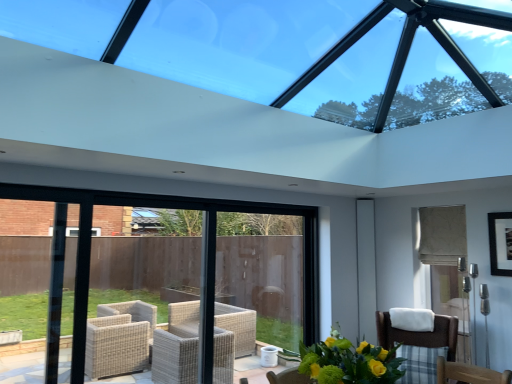
This screenshot has width=512, height=384. What do you see at coordinates (366, 269) in the screenshot?
I see `white glossy screen door at right` at bounding box center [366, 269].

Find the location of a particular element. This screenshot has width=512, height=384. white glossy screen door at right is located at coordinates (366, 269).

Describe the element at coordinates (500, 243) in the screenshot. I see `black matte picture frame at upper right` at that location.

Where is `transparent glass window at upper center`? The image size is (512, 384). transparent glass window at upper center is located at coordinates (316, 54).

Locate an element on the screen. The height and width of the screenshot is (384, 512). brown woven chair at lower right is located at coordinates (420, 345).

From a real-world perspective, which object rests below the other?

black matte picture frame at upper right, from a real-world perspective.

Which is correct: transparent glass window at upper center is inside black matte picture frame at upper right, or outside of it?

transparent glass window at upper center is spatially situated outside black matte picture frame at upper right.

Is point (494, 27) in front of point (511, 261)?

Yes, it is.

Does black matte picture frame at upper right have a lesser height compared to white glossy screen door at right?

Yes, black matte picture frame at upper right is shorter than white glossy screen door at right.

Considering the sizes of objects black matte picture frame at upper right and white glossy screen door at right in the image provided, who is smaller, black matte picture frame at upper right or white glossy screen door at right?

black matte picture frame at upper right.

Is white glossy screen door at right at the back of black matte picture frame at upper right?

No.

From the image's perspective, which object appears higher, transparent glass window at upper center or yellow-green bouquet at lower center?

transparent glass window at upper center appears higher in the image.

Is transparent glass window at upper center positioned far away from yellow-green bouquet at lower center?

transparent glass window at upper center is positioned a significant distance from yellow-green bouquet at lower center.

Is transparent glass window at upper center completely or partially outside of yellow-green bouquet at lower center?

Yes, transparent glass window at upper center is located beyond the bounds of yellow-green bouquet at lower center.

Does transparent glass window at upper center have a smaller size compared to yellow-green bouquet at lower center?

Actually, transparent glass window at upper center might be larger than yellow-green bouquet at lower center.

From a real-world perspective, relative to yellow-green bouquet at lower center, is black matte picture frame at upper right vertically above or below?

black matte picture frame at upper right is situated higher than yellow-green bouquet at lower center in the real world.

Which is correct: black matte picture frame at upper right is inside yellow-green bouquet at lower center, or outside of it?

The correct answer is: outside.

From the image's perspective, is black matte picture frame at upper right positioned above or below yellow-green bouquet at lower center?

black matte picture frame at upper right is above yellow-green bouquet at lower center.

From the picture: Considering the positions of objects black matte picture frame at upper right and yellow-green bouquet at lower center in the image provided, who is in front, black matte picture frame at upper right or yellow-green bouquet at lower center?

Positioned in front is yellow-green bouquet at lower center.

Is point (372, 251) closer to viewer compared to point (364, 358)?

That is False.

From the picture: Who is taller, white glossy screen door at right or yellow-green bouquet at lower center?

Standing taller between the two is white glossy screen door at right.

From the image's perspective, is white glossy screen door at right positioned above or below yellow-green bouquet at lower center?

white glossy screen door at right is below yellow-green bouquet at lower center.

What's the angular difference between white glossy screen door at right and yellow-green bouquet at lower center's facing directions?

They differ by 47 degrees in their facing directions.

Is the surface of black matte picture frame at upper right in direct contact with transparent glass window at upper center?

No, black matte picture frame at upper right is not with transparent glass window at upper center.

Is black matte picture frame at upper right further to the viewer compared to transparent glass window at upper center?

Yes, it is behind transparent glass window at upper center.

Looking at this image, from the image's perspective, which one is positioned higher, black matte picture frame at upper right or transparent glass window at upper center?

transparent glass window at upper center appears higher in the image.

Considering the sizes of objects black matte picture frame at upper right and transparent glass window at upper center in the image provided, who is taller, black matte picture frame at upper right or transparent glass window at upper center?

With more height is transparent glass window at upper center.

Which of these two, brown woven chair at lower right or transparent glass window at upper center, is thinner?

Thinner between the two is brown woven chair at lower right.

Which of these two, brown woven chair at lower right or transparent glass window at upper center, stands taller?

Standing taller between the two is transparent glass window at upper center.

From the image's perspective, does brown woven chair at lower right appear lower than transparent glass window at upper center?

Correct, brown woven chair at lower right appears lower than transparent glass window at upper center in the image.

Based on the photo, from a real-world perspective, who is located higher, brown woven chair at lower right or transparent glass window at upper center?

transparent glass window at upper center is physically above.

Where is `window that appears above the black matte picture frame at upper right (from the image's perspective)`? The width and height of the screenshot is (512, 384). window that appears above the black matte picture frame at upper right (from the image's perspective) is located at coordinates (316, 54).

Where is `screen door below the black matte picture frame at upper right (from the image's perspective)`? This screenshot has height=384, width=512. screen door below the black matte picture frame at upper right (from the image's perspective) is located at coordinates (366, 269).

From the image, which object appears to be nearer to brown woven chair at lower right, yellow-green bouquet at lower center or white glossy screen door at right?

white glossy screen door at right is positioned closer to the anchor brown woven chair at lower right.

When comparing their distances from yellow-green bouquet at lower center, does white glossy screen door at right or black matte picture frame at upper right seem further?

The object further to yellow-green bouquet at lower center is white glossy screen door at right.

When comparing their distances from yellow-green bouquet at lower center, does white glossy screen door at right or brown woven chair at lower right seem further?

white glossy screen door at right is further to yellow-green bouquet at lower center.

Looking at the image, which one is located closer to white glossy screen door at right, brown woven chair at lower right or black matte picture frame at upper right?

Based on the image, brown woven chair at lower right appears to be nearer to white glossy screen door at right.

Based on their spatial positions, is transparent glass window at upper center or yellow-green bouquet at lower center closer to black matte picture frame at upper right?

Based on the image, transparent glass window at upper center appears to be nearer to black matte picture frame at upper right.

From the image, which object appears to be nearer to yellow-green bouquet at lower center, black matte picture frame at upper right or transparent glass window at upper center?

transparent glass window at upper center is closer to yellow-green bouquet at lower center.

From the image, which object appears to be farther from yellow-green bouquet at lower center, brown woven chair at lower right or transparent glass window at upper center?

Among the two, transparent glass window at upper center is located further to yellow-green bouquet at lower center.

Estimate the real-world distances between objects in this image. Which object is closer to black matte picture frame at upper right, yellow-green bouquet at lower center or white glossy screen door at right?

The object closer to black matte picture frame at upper right is white glossy screen door at right.

You are a GUI agent. You are given a task and a screenshot of the screen. Output one action in this format:
    pyautogui.click(x=<x>, y=<y>)
    Task: Click on the floral arrangement between transparent glass window at upper center and white glossy screen door at right along the z-axis
    
    Given the screenshot: What is the action you would take?
    pyautogui.click(x=349, y=362)

The width and height of the screenshot is (512, 384). Find the location of `floral arrangement between transparent glass window at upper center and brown woven chair at lower right vertically`. floral arrangement between transparent glass window at upper center and brown woven chair at lower right vertically is located at coordinates (349, 362).

Image resolution: width=512 pixels, height=384 pixels. Find the location of `picture frame positioned between brown woven chair at lower right and white glossy screen door at right from near to far`. picture frame positioned between brown woven chair at lower right and white glossy screen door at right from near to far is located at coordinates tap(500, 243).

I want to click on chair between transparent glass window at upper center and white glossy screen door at right along the z-axis, so (420, 345).